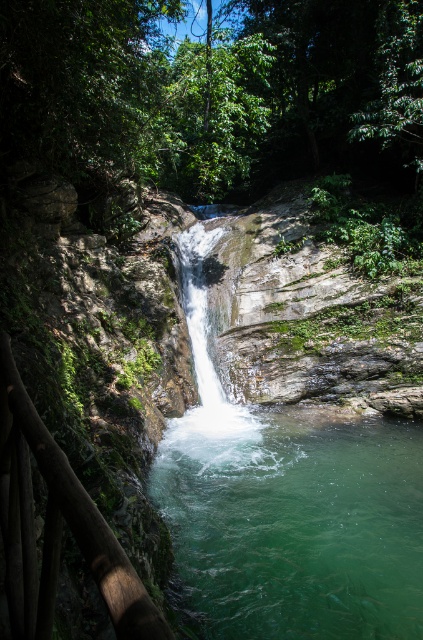
Is green translucent water at center to the right of clear water at center from the viewer's perspective?

Indeed, green translucent water at center is positioned on the right side of clear water at center.

Is point (324, 541) positioned after point (189, 284)?

No, it is not.

This screenshot has width=423, height=640. What do you see at coordinates (293, 524) in the screenshot? I see `green translucent water at center` at bounding box center [293, 524].

This screenshot has width=423, height=640. What are the coordinates of `green translucent water at center` in the screenshot? It's located at (293, 524).